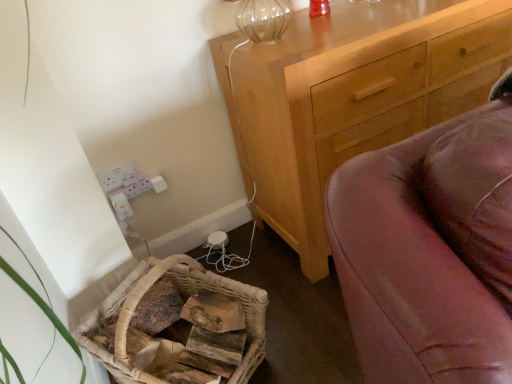
Consider the image. Measure the distance between point (470, 62) and camera.

5.14 feet.

Find the location of a particular element. Image resolution: width=512 pixels, height=384 pixels. light brown wooden chest of drawers at upper right is located at coordinates (350, 96).

The width and height of the screenshot is (512, 384). What do you see at coordinates (350, 96) in the screenshot?
I see `light brown wooden chest of drawers at upper right` at bounding box center [350, 96].

What do you see at coordinates (184, 290) in the screenshot? I see `woven wood basket at lower left` at bounding box center [184, 290].

You are a GUI agent. You are given a task and a screenshot of the screen. Output one action in this format:
    pyautogui.click(x=<x>, y=<y>)
    Task: Click on the woven wood basket at lower left
    This screenshot has width=512, height=384.
    Given the screenshot: What is the action you would take?
    pyautogui.click(x=184, y=290)

At what (x,y) coordinates should I click in order to perform the action: click on light brown wooden chest of drawers at upper right. Please return your answer as a coordinate pair (x, y). The width and height of the screenshot is (512, 384). Looking at the image, I should click on (350, 96).

Based on the photo, considering the relative positions of light brown wooden chest of drawers at upper right and woven wood basket at lower left in the image provided, is light brown wooden chest of drawers at upper right to the right of woven wood basket at lower left from the viewer's perspective?

Yes.

Which object is further away from the camera, light brown wooden chest of drawers at upper right or woven wood basket at lower left?

light brown wooden chest of drawers at upper right is behind.

Which is closer to the camera, (407, 111) or (234, 372)?

The point (234, 372) is more forward.

From the image's perspective, which one is positioned lower, light brown wooden chest of drawers at upper right or woven wood basket at lower left?

From the image's view, woven wood basket at lower left is below.

From a real-world perspective, between light brown wooden chest of drawers at upper right and woven wood basket at lower left, who is vertically higher?

light brown wooden chest of drawers at upper right is physically above.

Between light brown wooden chest of drawers at upper right and woven wood basket at lower left, which one has smaller width?

With smaller width is woven wood basket at lower left.

Is light brown wooden chest of drawers at upper right shorter than woven wood basket at lower left?

No.

Is light brown wooden chest of drawers at upper right bigger than woven wood basket at lower left?

Yes, light brown wooden chest of drawers at upper right is bigger than woven wood basket at lower left.

Is woven wood basket at lower left inside light brown wooden chest of drawers at upper right?

No, woven wood basket at lower left is located outside of light brown wooden chest of drawers at upper right.

Is the surface of light brown wooden chest of drawers at upper right in direct contact with woven wood basket at lower left?

No, light brown wooden chest of drawers at upper right is not with woven wood basket at lower left.

Is light brown wooden chest of drawers at upper right positioned with its back to woven wood basket at lower left?

That's not correct — light brown wooden chest of drawers at upper right is not looking away from woven wood basket at lower left.

Identify the location of basket in front of the light brown wooden chest of drawers at upper right. [184, 290].

In the image, is woven wood basket at lower left on the left side or the right side of light brown wooden chest of drawers at upper right?

woven wood basket at lower left is to the left of light brown wooden chest of drawers at upper right.

Is the position of woven wood basket at lower left more distant than that of light brown wooden chest of drawers at upper right?

No, woven wood basket at lower left is in front of light brown wooden chest of drawers at upper right.

Is point (229, 289) closer to viewer compared to point (383, 50)?

No.

From the image's perspective, relative to light brown wooden chest of drawers at upper right, is woven wood basket at lower left above or below?

woven wood basket at lower left is situated lower than light brown wooden chest of drawers at upper right in the image.

From a real-world perspective, which object stands above the other?

From a 3D spatial view, light brown wooden chest of drawers at upper right is above.

Is woven wood basket at lower left wider than light brown wooden chest of drawers at upper right?

In fact, woven wood basket at lower left might be narrower than light brown wooden chest of drawers at upper right.

Which of these two, woven wood basket at lower left or light brown wooden chest of drawers at upper right, stands shorter?

woven wood basket at lower left is shorter.

Considering the sizes of objects woven wood basket at lower left and light brown wooden chest of drawers at upper right in the image provided, who is smaller, woven wood basket at lower left or light brown wooden chest of drawers at upper right?

woven wood basket at lower left.

Is woven wood basket at lower left surrounding light brown wooden chest of drawers at upper right?

No, light brown wooden chest of drawers at upper right is not a part of woven wood basket at lower left.

Would you consider woven wood basket at lower left to be distant from light brown wooden chest of drawers at upper right?

Actually, woven wood basket at lower left and light brown wooden chest of drawers at upper right are a little close together.

Is woven wood basket at lower left looking in the opposite direction of light brown wooden chest of drawers at upper right?

No, woven wood basket at lower left is not facing the opposite direction of light brown wooden chest of drawers at upper right.

You are a GUI agent. You are given a task and a screenshot of the screen. Output one action in this format:
    pyautogui.click(x=<x>, y=<y>)
    Task: Click on the basket that is under the light brown wooden chest of drawers at upper right (from a real-world perspective)
    Image resolution: width=512 pixels, height=384 pixels.
    Given the screenshot: What is the action you would take?
    pyautogui.click(x=184, y=290)

You are a GUI agent. You are given a task and a screenshot of the screen. Output one action in this format:
    pyautogui.click(x=<x>, y=<y>)
    Task: Click on the basket on the left of the light brown wooden chest of drawers at upper right
    
    Given the screenshot: What is the action you would take?
    pyautogui.click(x=184, y=290)

Where is `the chest of drawers above the woven wood basket at lower left (from the image's perspective)`? the chest of drawers above the woven wood basket at lower left (from the image's perspective) is located at coordinates (350, 96).